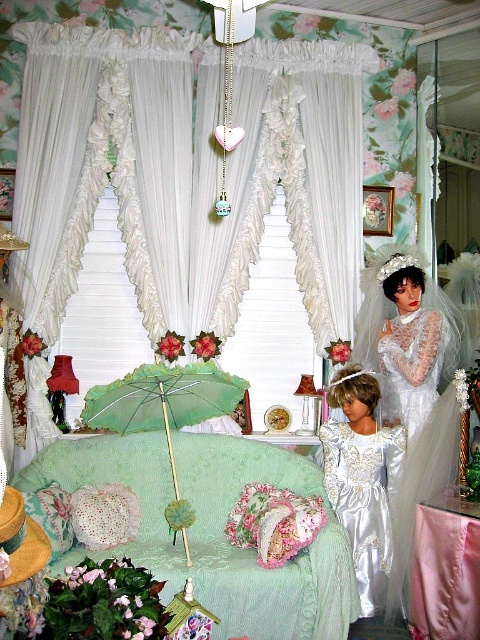
Question: Which of the following is the farthest from the observer?

Choices:
 (A) light green fabric canopy bed at center
 (B) satin/embroidered dress at center
 (C) white sheer curtains at center
 (D) green lace parasol at center

Answer: (C)

Question: Is satin/embroidered dress at center positioned at the back of green lace parasol at center?

Choices:
 (A) yes
 (B) no

Answer: (A)

Question: Estimate the real-world distances between objects in this image. Which object is farther from the light green fabric canopy bed at center?

Choices:
 (A) white sheer curtains at center
 (B) satin lace dress at center
 (C) green lace parasol at center
 (D) satin/embroidered dress at center

Answer: (A)

Question: Observing the image, what is the correct spatial positioning of white sheer curtains at center in reference to satin lace dress at center?

Choices:
 (A) below
 (B) above

Answer: (B)

Question: Which object is the farthest from the light green fabric canopy bed at center?

Choices:
 (A) satin/embroidered dress at center
 (B) white sheer curtains at center

Answer: (B)

Question: Is white sheer curtains at center in front of satin/embroidered dress at center?

Choices:
 (A) no
 (B) yes

Answer: (A)